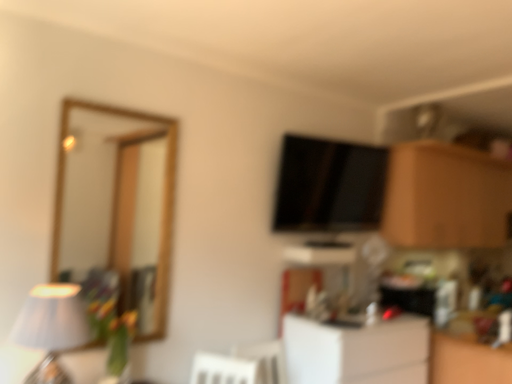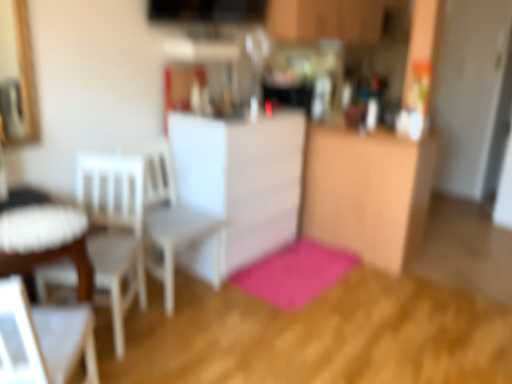
Question: Which way did the camera rotate in the video?

Choices:
 (A) rotated left
 (B) rotated right

Answer: (B)